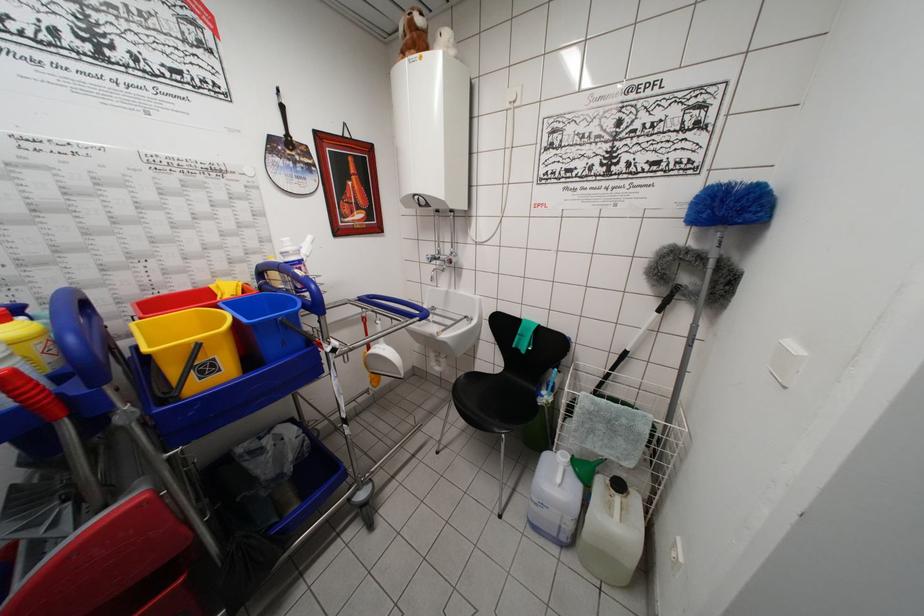
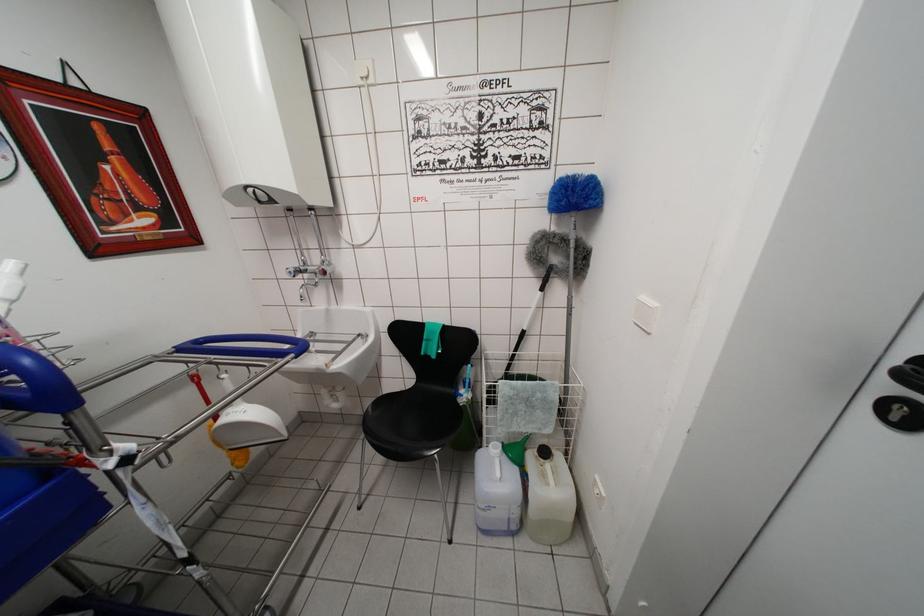
The point at [702,217] is marked in the first image. Where is the corresponding point in the second image?

(562, 206)